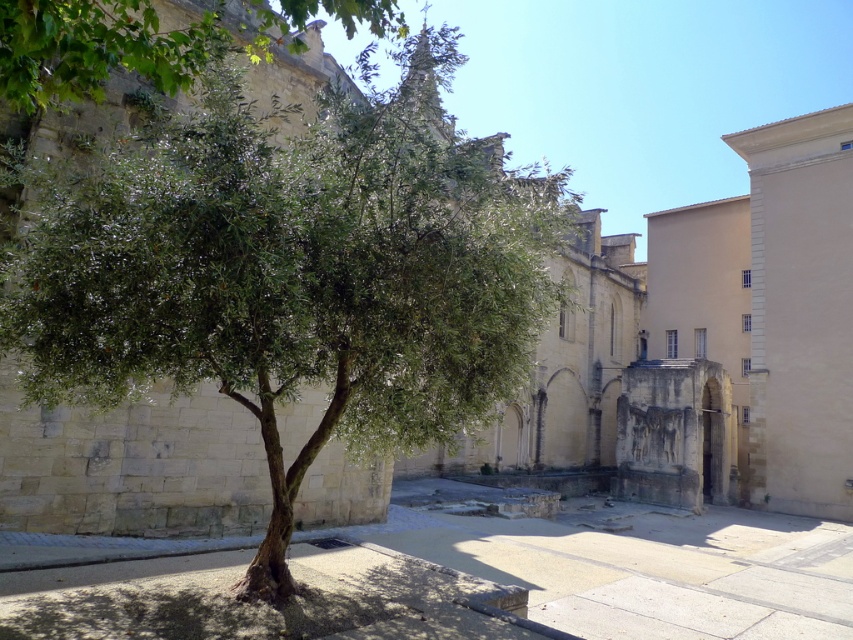
In the scene shown: Is green leafy tree at left positioned before smooth stone pavement at center?

Yes, green leafy tree at left is closer to the viewer.

Identify the location of green leafy tree at left. (293, 273).

Image resolution: width=853 pixels, height=640 pixels. Describe the element at coordinates (293, 273) in the screenshot. I see `green leafy tree at left` at that location.

Looking at this image, is green leafy tree at left closer to the viewer compared to green leafy tree at upper left?

That is False.

The width and height of the screenshot is (853, 640). Describe the element at coordinates (293, 273) in the screenshot. I see `green leafy tree at left` at that location.

The image size is (853, 640). Identify the location of green leafy tree at left. (293, 273).

Does smooth stone pavement at center have a lesser height compared to green leafy tree at upper left?

Correct, smooth stone pavement at center is not as tall as green leafy tree at upper left.

Can you confirm if smooth stone pavement at center is positioned below green leafy tree at upper left?

Correct, smooth stone pavement at center is located below green leafy tree at upper left.

Locate an element on the screen. This screenshot has height=640, width=853. smooth stone pavement at center is located at coordinates (439, 589).

Identify the location of smooth stone pavement at center. (439, 589).